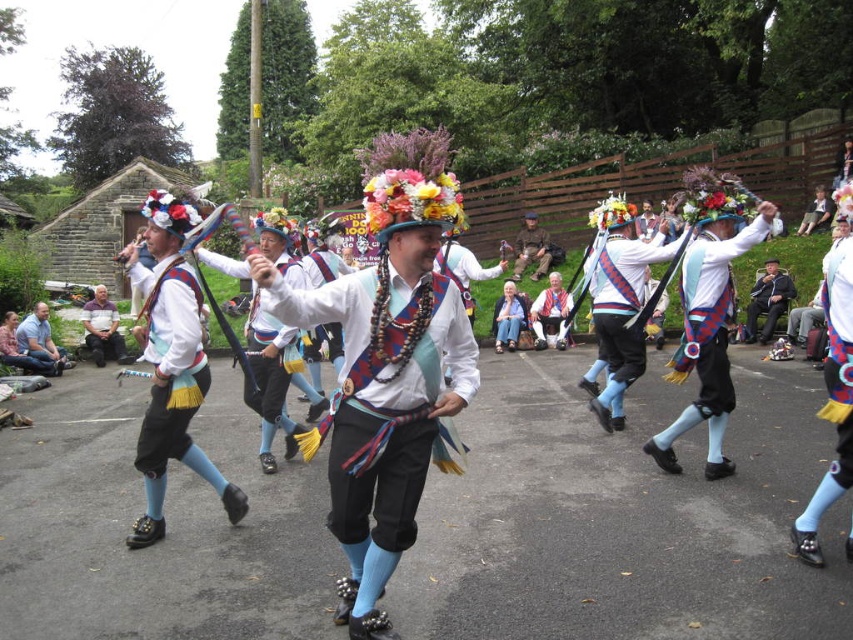
You are a photographer trying to capture the dancers in the scene. You notice the matte black pants at left and the dark blue fabric hat at center. Which object should you focus on if you want to photograph something taller?

The matte black pants at left is taller than the dark blue fabric hat at center, so you should focus on the matte black pants at left.

You are a photographer trying to capture a closeup of the dark blue fabric hat at center and matte white shirt at center. Since you want to focus on the hat, which object should you move closer to the camera to ensure the hat appears larger in the photo?

To make the dark blue fabric hat at center appear larger in the photo, you should move it closer to the camera since it has a lesser width compared to the matte white shirt at center, requiring it to be nearer to achieve a similar size in the frame.

You are a photographer trying to capture the perfect shot of the matte black pants at left and the dark blue fabric hat at center. Based on their positions, which object is closer to the camera?

The dark blue fabric hat at center is closer to the camera because the matte black pants at left is positioned under it, indicating it is behind the hat.